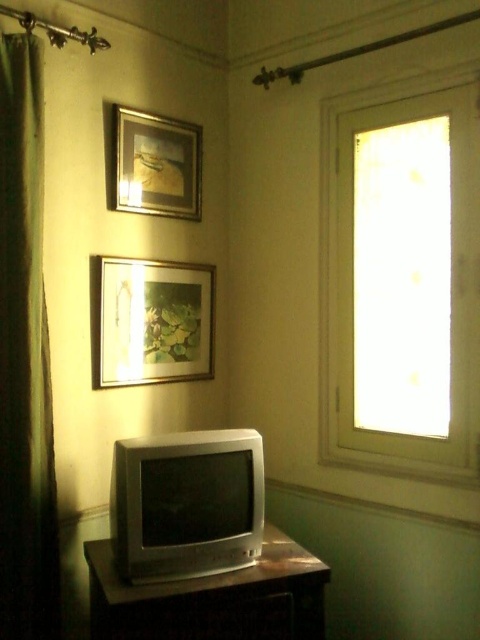
You are organizing a room and want to place a new plant on the floor near the metallic silver dresser at lower center. However, you need to ensure there is enough space between the dresser and the matte wooden picture frame at center. Can you confirm if the dresser is positioned below the frame?

The metallic silver dresser at lower center is below the matte wooden picture frame at center, so placing the plant near the dresser should leave enough space between them.

You are arranging a vase on the metallic silver dresser at lower center. If you want to place it so that it also faces the matte wooden picture frame at center, in which direction should you position the vase?

The metallic silver dresser at lower center is in front of the matte wooden picture frame at center, so positioning the vase towards the back of the dresser would face it toward the matte wooden picture frame at center.

You are arranging a new painting in this room and need to place it between the metallic silver dresser at lower center and the wooden frame at upper center. Based on their positions, which object should the new painting be closer to?

The new painting should be closer to the wooden frame at upper center because the metallic silver dresser at lower center is positioned to the right of the wooden frame at upper center, meaning the frame is to the left of the dresser. Therefore, placing the painting between them would require it to be closer to the wooden frame at upper center to maintain the leftward position.